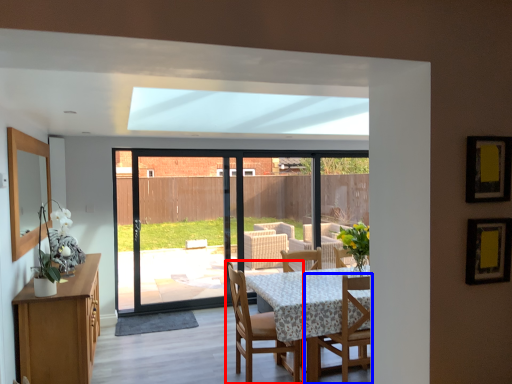
Question: Which point is further to the camera, chair (highlighted by a red box) or chair (highlighted by a blue box)?

Choices:
 (A) chair
 (B) chair

Answer: (A)